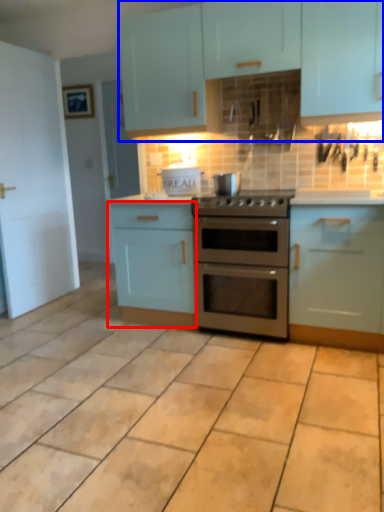
Question: Which point is closer to the camera, cabinetry (highlighted by a red box) or cabinetry (highlighted by a blue box)?

Choices:
 (A) cabinetry
 (B) cabinetry

Answer: (B)